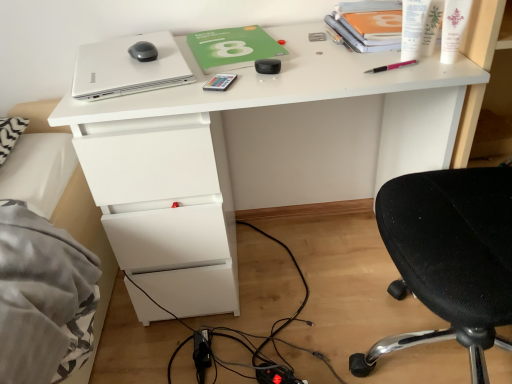
This screenshot has width=512, height=384. Find the location of `vacant area that lies to the right of metallic rectangular object at center, which is the fourth stationery in right-to-left order`. vacant area that lies to the right of metallic rectangular object at center, which is the fourth stationery in right-to-left order is located at coordinates (289, 75).